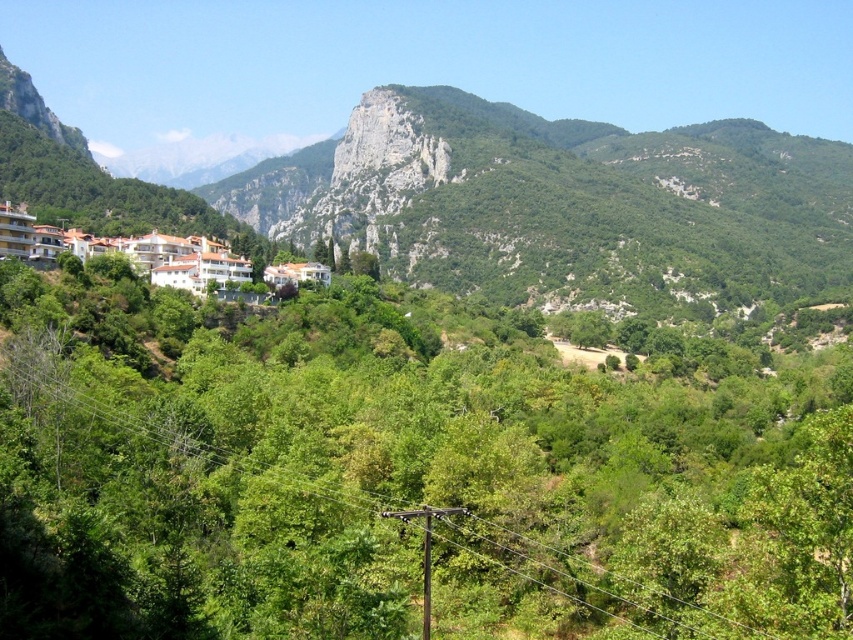
You are standing at the base of the green rocky mountain at upper center and want to reach the white glossy buildings at lower left. Which direction should you move to get there?

You should move to the left because the white glossy buildings at lower left are positioned to the left of the green rocky mountain at upper center.

You are an environmental planner assessing the landscape. You notice the green leafy tree at upper center and the green rocky mountain at upper center. Which of these two occupies a larger area in the scene?

The green rocky mountain at upper center occupies a larger area than the green leafy tree at upper center.